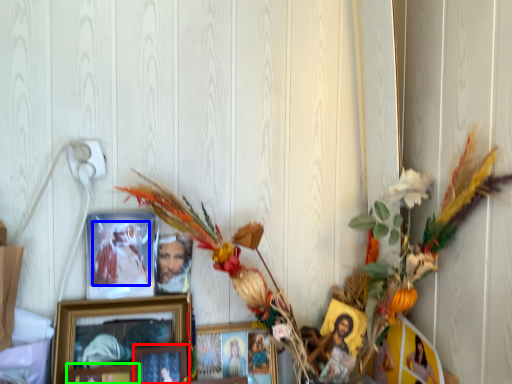
Question: Estimate the real-world distances between objects in this image. Which object is closer to picture frame (highlighted by a red box), person (highlighted by a blue box) or picture frame (highlighted by a green box)?

Choices:
 (A) person
 (B) picture frame

Answer: (B)